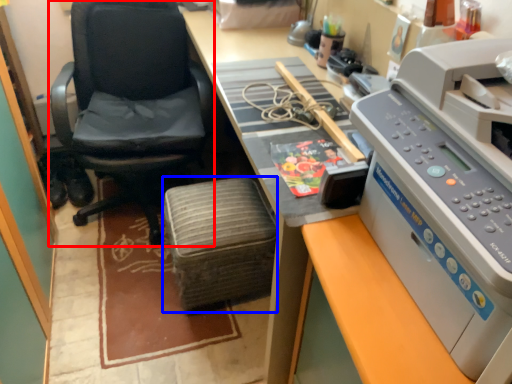
Question: Which object is further to the camera taking this photo, chair (highlighted by a red box) or stool (highlighted by a blue box)?

Choices:
 (A) chair
 (B) stool

Answer: (B)